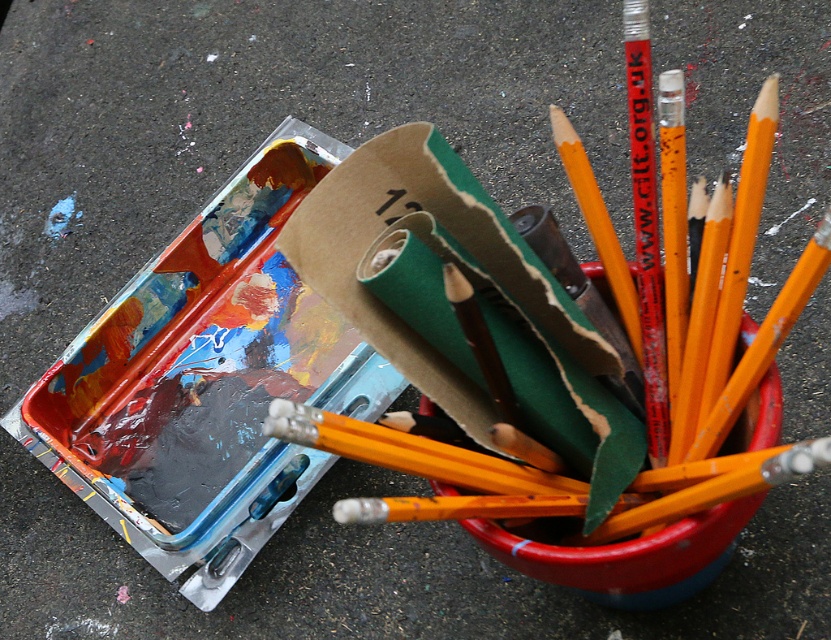
Does orange wood pencil at upper right appear on the left side of white eraser at center?

No, orange wood pencil at upper right is not to the left of white eraser at center.

How much distance is there between orange wood pencil at upper right and white eraser at center?

orange wood pencil at upper right is 6.26 inches away from white eraser at center.

Find the location of a particular element. The height and width of the screenshot is (640, 831). orange wood pencil at upper right is located at coordinates (765, 342).

The width and height of the screenshot is (831, 640). Describe the element at coordinates (740, 244) in the screenshot. I see `smooth orange pencil at upper right` at that location.

At what (x,y) coordinates should I click in order to perform the action: click on smooth orange pencil at upper right. Please return your answer as a coordinate pair (x, y). The height and width of the screenshot is (640, 831). Looking at the image, I should click on (740, 244).

This screenshot has height=640, width=831. Find the location of `smooth orange pencil at upper right`. smooth orange pencil at upper right is located at coordinates (740, 244).

Is yellow wood paint brush at upper center below orange wood pencil at upper right?

Indeed, yellow wood paint brush at upper center is positioned under orange wood pencil at upper right.

Is yellow wood paint brush at upper center positioned behind orange wood pencil at upper right?

No.

Identify the location of yellow wood paint brush at upper center. The image size is (831, 640). (715, 490).